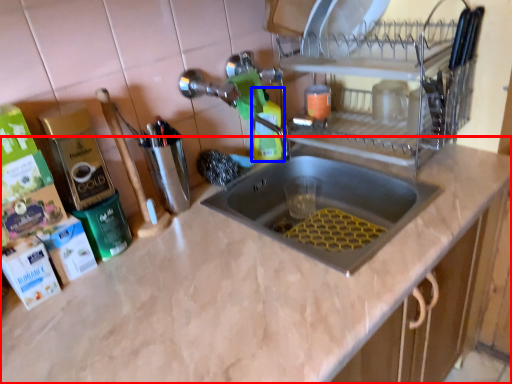
Question: Which point is closer to the camera, countertop (highlighted by a red box) or cleaning product (highlighted by a blue box)?

Choices:
 (A) countertop
 (B) cleaning product

Answer: (A)